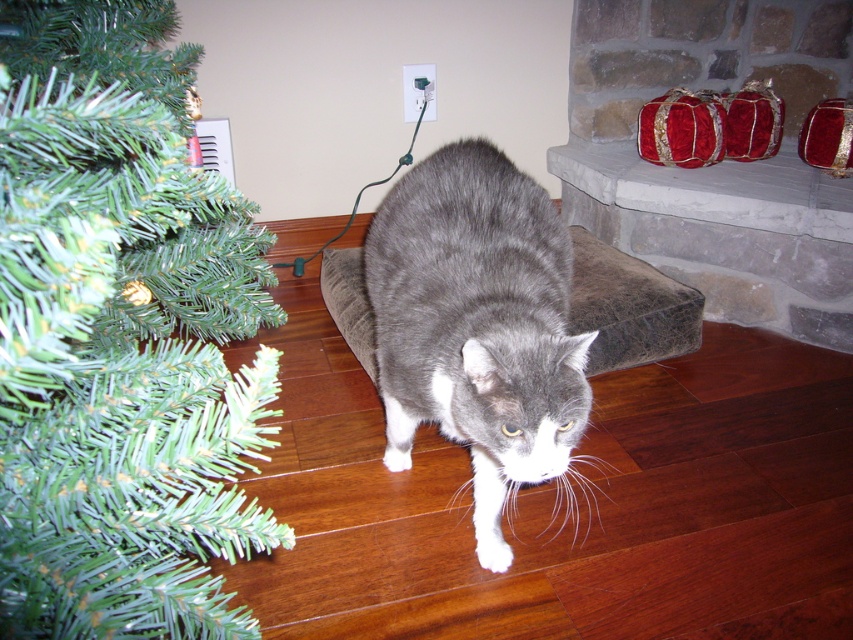
You are a photographer setting up a shot of the gray fur cat at center and the green artificial at left. To ensure both subjects are in frame, should you position yourself to the left or right of the cat?

You should position yourself to the right of the gray fur cat at center because the green artificial at left is to the left of the cat, so placing yourself to the right will keep both subjects within the frame.

You are a cat owner who wants to ensure your gray fur cat at center can reach the top of the green artificial at left Christmas tree. Based on their heights, can the cat reach the top of the tree?

The green artificial at left has a greater height compared to the gray fur cat at center. Since the tree is taller than the cat, the cat cannot reach the top of the tree.

You are a photographer trying to capture a clear shot of the green artificial at left and the gray fur cat at center. Since the cat is moving, you want to focus on the tree first. Based on their positions, which object should you focus on first to ensure the tree is sharp?

The green artificial at left is in front of the gray fur cat at center, so you should focus on the green artificial at left first to ensure it is sharp before the cat moves.